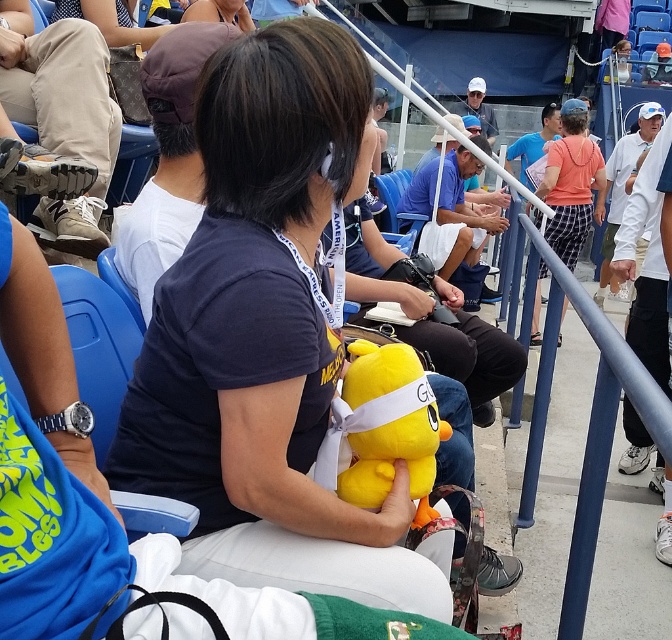
Question: Which point is closer to the camera?

Choices:
 (A) orange cotton shirt at center
 (B) yellow plush toy at center

Answer: (B)

Question: Can you confirm if matte yellow plush toy at center is bigger than yellow plush toy at center?

Choices:
 (A) no
 (B) yes

Answer: (B)

Question: Is matte yellow plush toy at center thinner than yellow plush toy at center?

Choices:
 (A) yes
 (B) no

Answer: (B)

Question: Considering the relative positions of matte yellow plush toy at center and yellow plush toy at center in the image provided, where is matte yellow plush toy at center located with respect to yellow plush toy at center?

Choices:
 (A) below
 (B) above

Answer: (B)

Question: Which object is the farthest from the yellow plush toy at center?

Choices:
 (A) matte yellow plush toy at center
 (B) orange cotton shirt at center

Answer: (B)

Question: Which object appears farthest from the camera in this image?

Choices:
 (A) matte yellow plush toy at center
 (B) yellow plush toy at center
 (C) orange cotton shirt at center

Answer: (C)